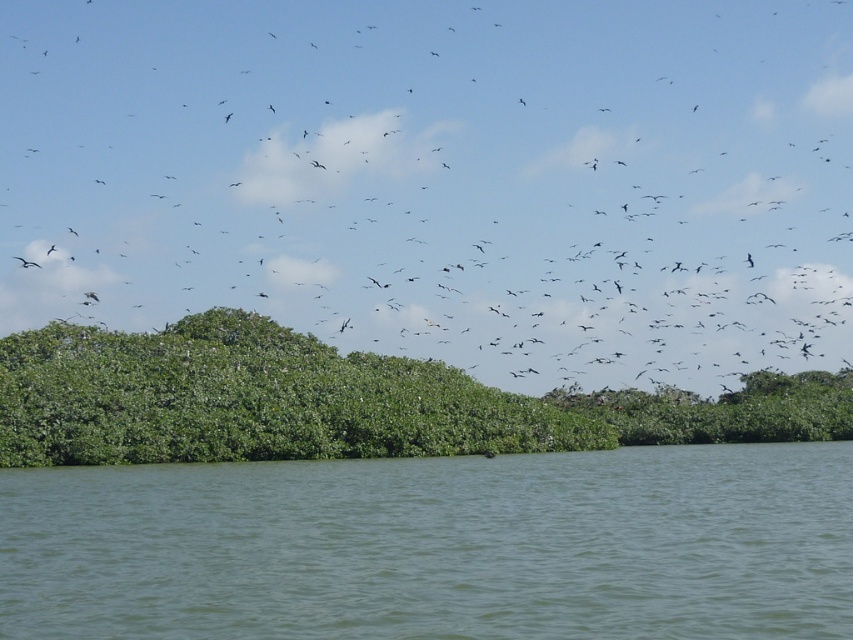
Does green liquid water at lower center appear on the left side of green leafy trees at center?

In fact, green liquid water at lower center is to the right of green leafy trees at center.

Can you confirm if green liquid water at lower center is wider than green leafy trees at center?

Correct, the width of green liquid water at lower center exceeds that of green leafy trees at center.

Is point (241, 582) positioned in front of point (283, 456)?

Yes.

At what (x,y) coordinates should I click in order to perform the action: click on green liquid water at lower center. Please return your answer as a coordinate pair (x, y). This screenshot has width=853, height=640. Looking at the image, I should click on (436, 547).

Who is higher up, black matte bird at center or green leafy trees at center?

black matte bird at center is higher up.

Which is in front, point (169, 305) or point (254, 380)?

Point (254, 380)

Identify the location of black matte bird at center. (442, 179).

At what (x,y) coordinates should I click in order to perform the action: click on black matte bird at center. Please return your answer as a coordinate pair (x, y). Looking at the image, I should click on (442, 179).

Which is below, black matte bird at center or green liquid water at lower center?

Positioned lower is green liquid water at lower center.

The height and width of the screenshot is (640, 853). In order to click on black matte bird at center in this screenshot , I will do `click(442, 179)`.